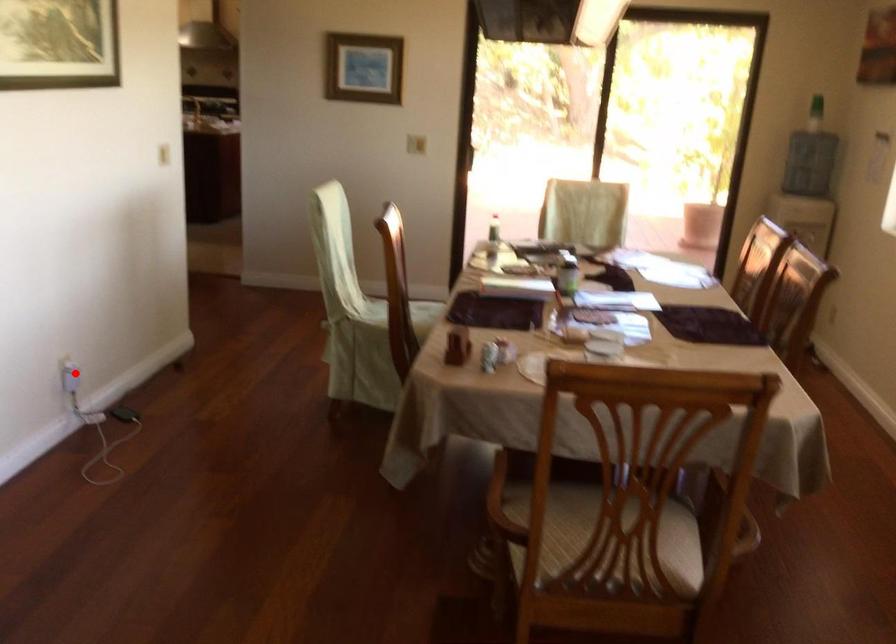
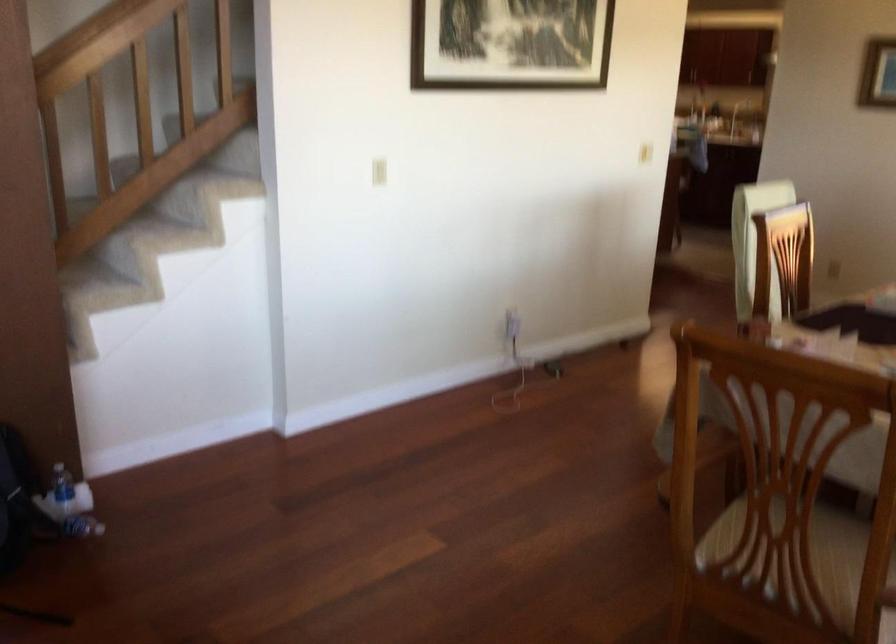
The point at the highlighted location is marked in the first image. Where is the corresponding point in the second image?

(512, 323)